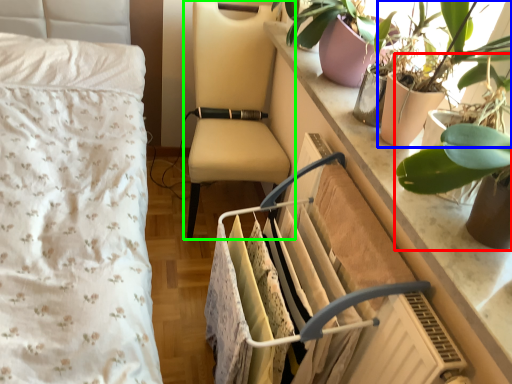
Question: Which object is positioned closest to houseplant (highlighted by a red box)? Select from houseplant (highlighted by a blue box) and chair (highlighted by a green box).

Choices:
 (A) houseplant
 (B) chair

Answer: (A)